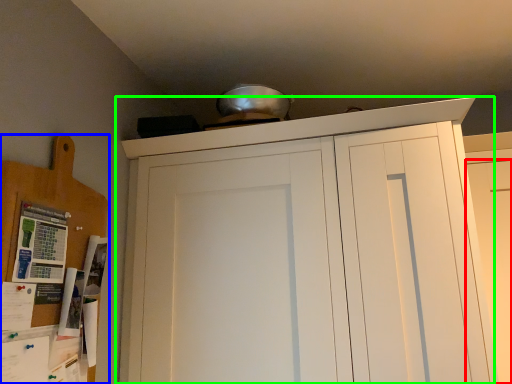
Question: Considering the real-world distances, which object is farthest from door (highlighted by a red box)? cabinetry (highlighted by a blue box) or cupboard (highlighted by a green box)?

Choices:
 (A) cabinetry
 (B) cupboard

Answer: (A)